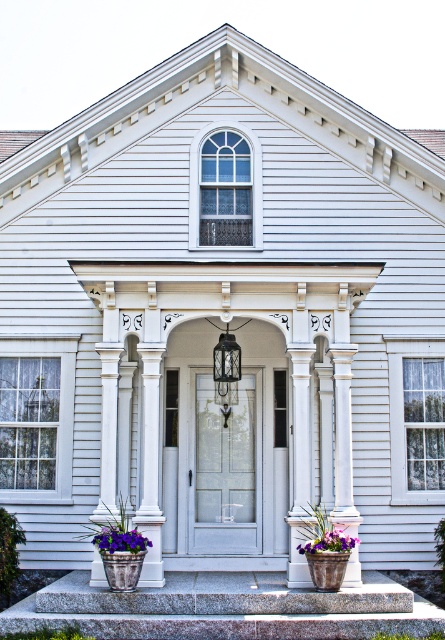
What do you see at coordinates (225, 609) in the screenshot?
I see `granite steps at center` at bounding box center [225, 609].

Does granite steps at center come in front of purple fabric flower at lower left?

Yes, it is.

Is point (44, 586) positioned behind point (116, 540)?

Yes, point (44, 586) is farther from viewer.

Where is `granite steps at center`? The height and width of the screenshot is (640, 445). granite steps at center is located at coordinates (225, 609).

Which of these two, granite steps at center or purple fabric flower at lower center, stands shorter?

With less height is purple fabric flower at lower center.

Is granite steps at center further to camera compared to purple fabric flower at lower center?

That is False.

This screenshot has height=640, width=445. I want to click on granite steps at center, so click(x=225, y=609).

Is the position of granite steps at center more distant than that of white frosted glass door at center?

No, granite steps at center is closer to the viewer.

Who is more forward, (17, 627) or (238, 460)?

Positioned in front is point (17, 627).

Image resolution: width=445 pixels, height=640 pixels. Find the location of `granite steps at center`. granite steps at center is located at coordinates pyautogui.click(x=225, y=609).